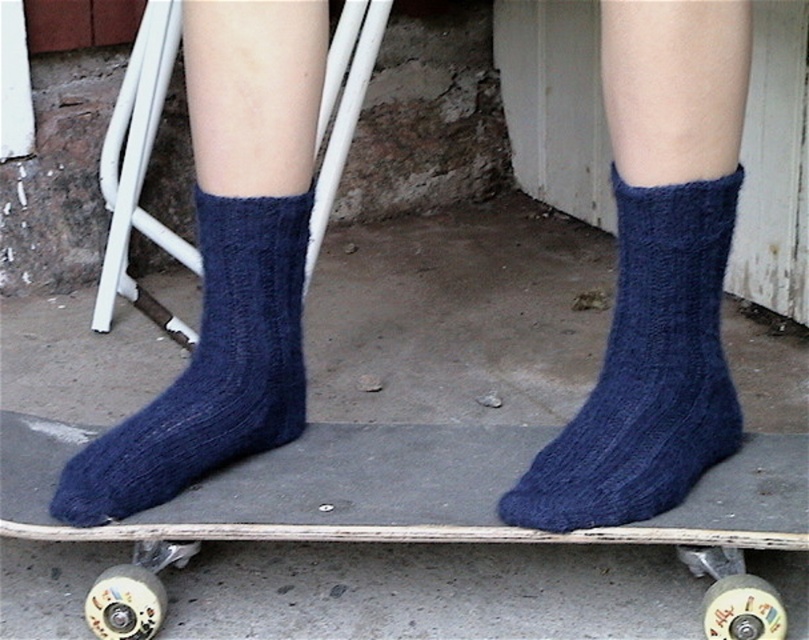
Is navy blue knitted socks at center taller than dark blue knitted sock at center?

Correct, navy blue knitted socks at center is much taller as dark blue knitted sock at center.

Does navy blue knitted socks at center appear over dark blue knitted sock at center?

Indeed, navy blue knitted socks at center is positioned over dark blue knitted sock at center.

In order to click on navy blue knitted socks at center in this screenshot , I will do `click(655, 273)`.

Where is `navy blue knitted socks at center`? navy blue knitted socks at center is located at coordinates (655, 273).

Between point (354, 461) and point (663, 477), which one is positioned in front?

Point (663, 477) is more forward.

Is dark blue knitted socks at center below dark blue knitted sock at center?

Indeed, dark blue knitted socks at center is positioned under dark blue knitted sock at center.

Measure the distance between dark blue knitted socks at center and camera.

dark blue knitted socks at center and camera are 30.44 inches apart.

This screenshot has height=640, width=809. In order to click on dark blue knitted socks at center in this screenshot , I will do `click(414, 506)`.

Can you confirm if dark blue knitted socks at center is positioned to the right of dark blue knitted sock at lower left?

Yes, dark blue knitted socks at center is to the right of dark blue knitted sock at lower left.

Is dark blue knitted socks at center thinner than dark blue knitted sock at lower left?

No, dark blue knitted socks at center is not thinner than dark blue knitted sock at lower left.

Does point (807, 480) lie in front of point (121, 449)?

No, it is behind (121, 449).

Find the location of a particular element. Image resolution: width=809 pixels, height=640 pixels. dark blue knitted socks at center is located at coordinates (414, 506).